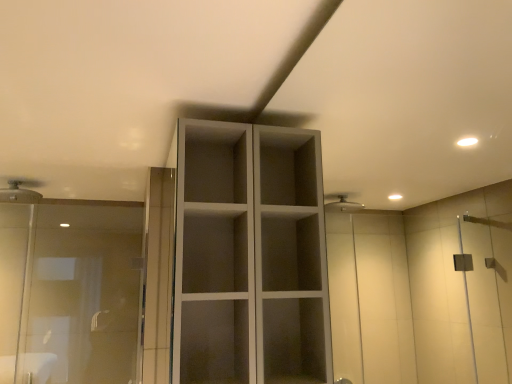
Question: Based on their sizes in the image, would you say matte white shower head at upper left is bigger or smaller than white matte cupboard at center?

Choices:
 (A) small
 (B) big

Answer: (A)

Question: In terms of height, does matte white shower head at upper left look taller or shorter compared to white matte cupboard at center?

Choices:
 (A) tall
 (B) short

Answer: (B)

Question: Which of these objects is positioned farthest from the matte white shower head at upper left?

Choices:
 (A) white matte cupboard at center
 (B) transparent glass shower door at left

Answer: (A)

Question: Which object is the closest to the transparent glass shower door at left?

Choices:
 (A) white matte cupboard at center
 (B) matte white shower head at upper left

Answer: (B)